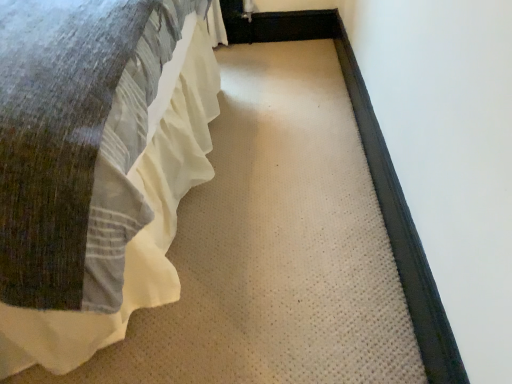
Question: Visually, is white cotton bed at left positioned to the left or to the right of black rubber doormat at right?

Choices:
 (A) left
 (B) right

Answer: (A)

Question: From a real-world perspective, relative to black rubber doormat at right, is white cotton bed at left vertically above or below?

Choices:
 (A) below
 (B) above

Answer: (B)

Question: Looking at their shapes, would you say white cotton bed at left is wider or thinner than black rubber doormat at right?

Choices:
 (A) wide
 (B) thin

Answer: (A)

Question: Relative to white cotton bed at left, is black rubber doormat at right in front or behind?

Choices:
 (A) front
 (B) behind

Answer: (B)

Question: Visually, is black rubber doormat at right positioned to the left or to the right of white cotton bed at left?

Choices:
 (A) left
 (B) right

Answer: (B)

Question: From the image's perspective, is black rubber doormat at right above or below white cotton bed at left?

Choices:
 (A) below
 (B) above

Answer: (A)

Question: Is black rubber doormat at right inside or outside of white cotton bed at left?

Choices:
 (A) outside
 (B) inside

Answer: (A)